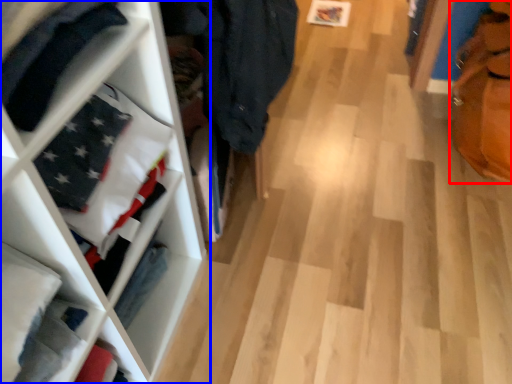
Question: Which object appears farthest to the camera in this image, tote bag (highlighted by a red box) or shelf (highlighted by a blue box)?

Choices:
 (A) tote bag
 (B) shelf

Answer: (A)